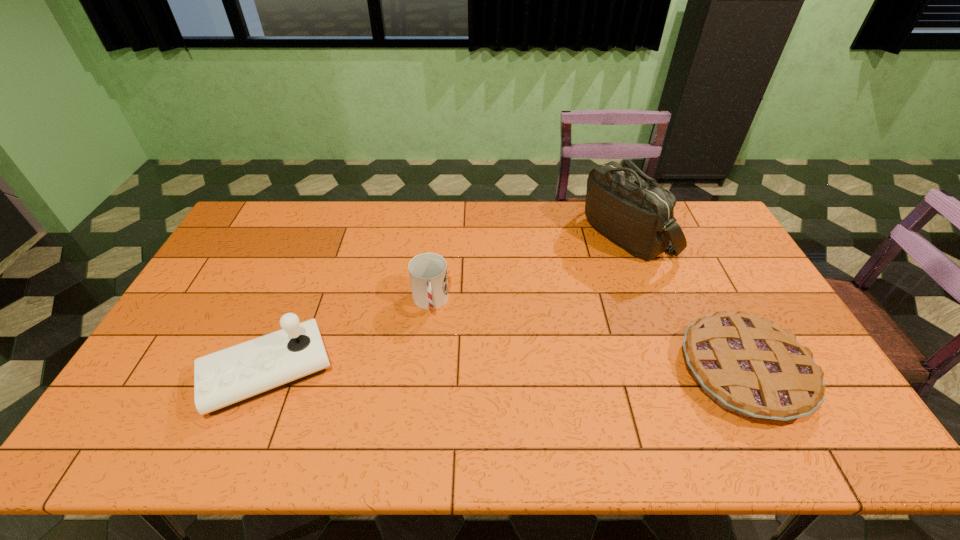
Where is `free spot that satisfies the following two spatial constraints: 1. on the front side of the pie; 2. on the left side of the shoulder bag`? free spot that satisfies the following two spatial constraints: 1. on the front side of the pie; 2. on the left side of the shoulder bag is located at coordinates (679, 372).